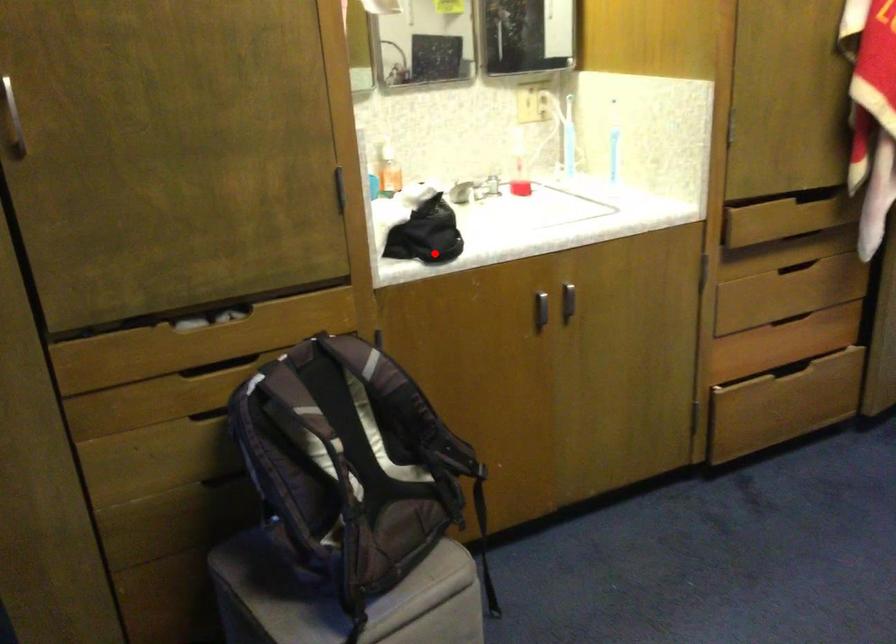
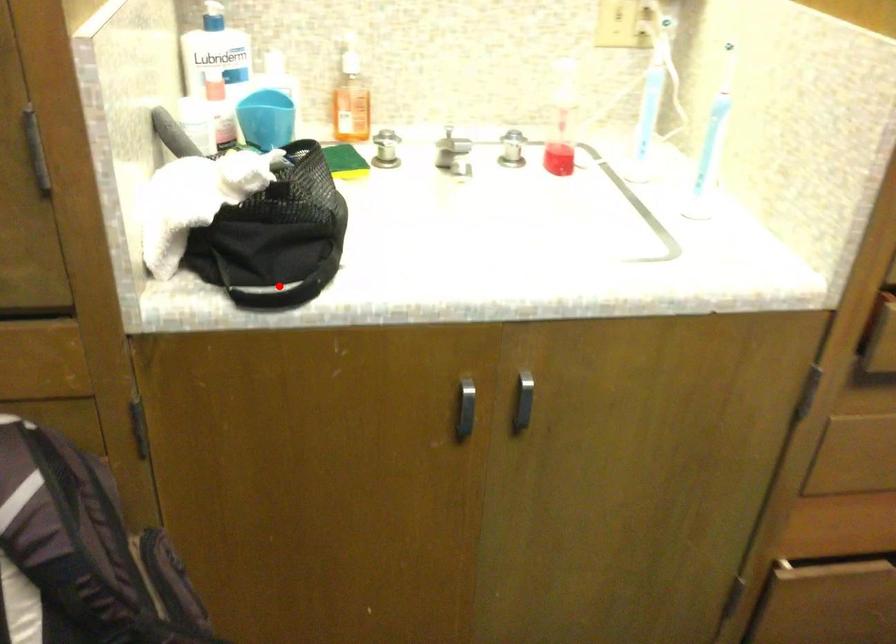
I am providing you with two images of the same scene from different viewpoints. A red point is marked on the first image and another point is marked on the second image. Are the points marked in image1 and image2 representing the same 3D position?

Yes